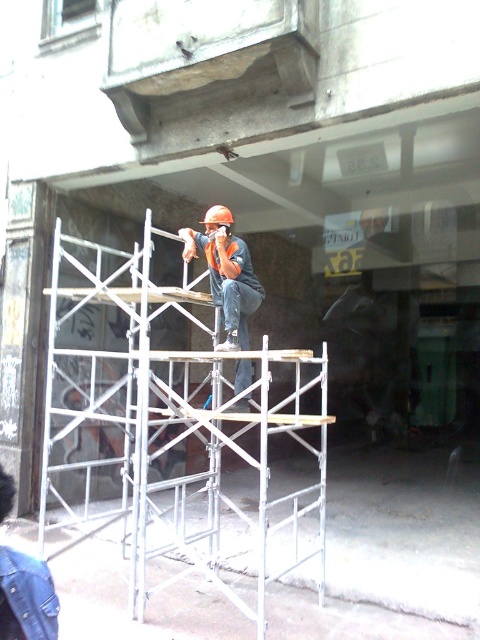
Can you confirm if silver metallic scaffolding at center is shorter than hard hat at center?

Incorrect, silver metallic scaffolding at center's height does not fall short of hard hat at center's.

Who is more forward, (144, 248) or (229, 221)?

Point (144, 248)

You are a GUI agent. You are given a task and a screenshot of the screen. Output one action in this format:
    pyautogui.click(x=<x>, y=<y>)
    Task: Click on the silver metallic scaffolding at center
    Image resolution: width=480 pixels, height=640 pixels.
    Given the screenshot: What is the action you would take?
    [x=170, y=429]

At what (x,y) coordinates should I click in order to perform the action: click on silver metallic scaffolding at center. Please return your answer as a coordinate pair (x, y). The height and width of the screenshot is (640, 480). Looking at the image, I should click on (170, 429).

Which is above, orange hard hat at center or hard hat at center?

hard hat at center is above.

Does orange hard hat at center have a lesser width compared to hard hat at center?

Incorrect, orange hard hat at center's width is not less than hard hat at center's.

Who is more forward, (249, 253) or (215, 216)?

Point (215, 216) is more forward.

Identify the location of orange hard hat at center. The image size is (480, 640). (226, 273).

Does silver metallic scaffolding at center have a larger size compared to orange hard hat at center?

Incorrect, silver metallic scaffolding at center is not larger than orange hard hat at center.

Which is in front, point (171, 552) or point (242, 289)?

Point (242, 289) is in front.

The image size is (480, 640). I want to click on silver metallic scaffolding at center, so pyautogui.click(x=170, y=429).